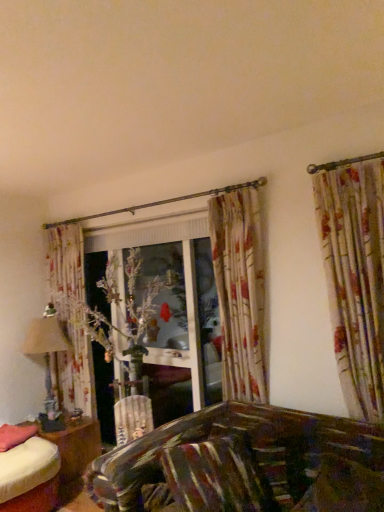
Image resolution: width=384 pixels, height=512 pixels. What do you see at coordinates (75, 446) in the screenshot? I see `wooden table at lower left` at bounding box center [75, 446].

Where is `pink fabric pillow at lower left, which is counted as the 1th pillow, starting from the left`? Image resolution: width=384 pixels, height=512 pixels. pink fabric pillow at lower left, which is counted as the 1th pillow, starting from the left is located at coordinates (15, 435).

Measure the distance between point (184, 489) and camera.

Point (184, 489) is 1.92 meters away from camera.

What do you see at coordinates (47, 352) in the screenshot? I see `matte beige lampshade at left` at bounding box center [47, 352].

Where is `wooden table at lower left`? Image resolution: width=384 pixels, height=512 pixels. wooden table at lower left is located at coordinates (75, 446).

Does pink fabric pillow at lower left, which is the first pillow in back-to-front order, have a lesser width compared to matte beige lampshade at left?

No.

Are pink fabric pillow at lower left, which is counted as the 1th pillow, starting from the left, and matte beige lampshade at left beside each other?

pink fabric pillow at lower left, which is counted as the 1th pillow, starting from the left, is not next to matte beige lampshade at left, and they're not touching.

Between pink fabric pillow at lower left, which is counted as the 1th pillow, starting from the left, and matte beige lampshade at left, which one appears on the right side from the viewer's perspective?

matte beige lampshade at left is more to the right.

From the image's perspective, which is above, pink fabric pillow at lower left, which is the first pillow in back-to-front order, or matte beige lampshade at left?

matte beige lampshade at left is shown above in the image.

Is striped fabric pillow at lower center, the first pillow when ordered from right to left, to the left or to the right of pink fabric pillow at lower left, which is the first pillow in back-to-front order, in the image?

From the image, it's evident that striped fabric pillow at lower center, the first pillow when ordered from right to left, is to the right of pink fabric pillow at lower left, which is the first pillow in back-to-front order.

From the image's perspective, is striped fabric pillow at lower center, the 2th pillow from the left, beneath pink fabric pillow at lower left, which is the first pillow in back-to-front order?

No, from the image's perspective, striped fabric pillow at lower center, the 2th pillow from the left, is not below pink fabric pillow at lower left, which is the first pillow in back-to-front order.

Are striped fabric pillow at lower center, the first pillow when ordered from right to left, and pink fabric pillow at lower left, which is the first pillow in back-to-front order, making contact?

striped fabric pillow at lower center, the first pillow when ordered from right to left, is not next to pink fabric pillow at lower left, which is the first pillow in back-to-front order, and they're not touching.

Which object is wider, striped fabric pillow at lower center, marked as the 1th pillow in a front-to-back arrangement, or pink fabric pillow at lower left, which is the 2th pillow in front-to-back order?

pink fabric pillow at lower left, which is the 2th pillow in front-to-back order, is wider.

From the picture: Does pink fabric pillow at lower left, which is the first pillow in back-to-front order, appear on the right side of striped fabric pillow at lower center, the first pillow when ordered from right to left?

No, pink fabric pillow at lower left, which is the first pillow in back-to-front order, is not to the right of striped fabric pillow at lower center, the first pillow when ordered from right to left.

Is pink fabric pillow at lower left, which is the first pillow in back-to-front order, taller than striped fabric pillow at lower center, marked as the second pillow in a back-to-front arrangement?

No.

Is pink fabric pillow at lower left, positioned as the second pillow in right-to-left order, behind striped fabric pillow at lower center, marked as the second pillow in a back-to-front arrangement?

Yes.

Considering the relative positions of matte beige lampshade at left and striped fabric pillow at lower center, marked as the 1th pillow in a front-to-back arrangement, in the image provided, is matte beige lampshade at left in front of striped fabric pillow at lower center, marked as the 1th pillow in a front-to-back arrangement,?

No, matte beige lampshade at left is further to the viewer.

Is matte beige lampshade at left taller or shorter than striped fabric pillow at lower center, the first pillow when ordered from right to left?

Considering their sizes, matte beige lampshade at left has more height than striped fabric pillow at lower center, the first pillow when ordered from right to left.

From a real-world perspective, who is located lower, matte beige lampshade at left or striped fabric pillow at lower center, the first pillow when ordered from right to left?

In real-world perspective, striped fabric pillow at lower center, the first pillow when ordered from right to left, is lower.

Does wooden table at lower left have a greater height compared to matte beige lampshade at left?

No.

Would you say wooden table at lower left is inside or outside matte beige lampshade at left?

wooden table at lower left is not enclosed by matte beige lampshade at left.

Is wooden table at lower left with matte beige lampshade at left?

They are not placed beside each other.

Is wooden table at lower left to the left or to the right of matte beige lampshade at left in the image?

Based on their positions, wooden table at lower left is located to the right of matte beige lampshade at left.

From the image's perspective, is matte beige lampshade at left positioned above or below wooden table at lower left?

Clearly, from the image's perspective, matte beige lampshade at left is above wooden table at lower left.

Between matte beige lampshade at left and wooden table at lower left, which one has smaller size?

Smaller between the two is wooden table at lower left.

Which is behind, point (53, 410) or point (66, 469)?

The point (53, 410) is farther.

Between matte beige lampshade at left and wooden table at lower left, which one appears on the left side from the viewer's perspective?

From the viewer's perspective, matte beige lampshade at left appears more on the left side.

Is the depth of wooden table at lower left less than that of pink fabric pillow at lower left, positioned as the second pillow in right-to-left order?

No, it is not.

From a real-world perspective, starting from the wooden table at lower left, which pillow is the 1st one vertically above it? Please provide its 2D coordinates.

[(15, 435)]

Would you say wooden table at lower left is inside or outside pink fabric pillow at lower left, positioned as the second pillow in right-to-left order?

wooden table at lower left is not enclosed by pink fabric pillow at lower left, positioned as the second pillow in right-to-left order.

Based on the photo, from the image's perspective, between wooden table at lower left and pink fabric pillow at lower left, which is counted as the 1th pillow, starting from the left, which one is located above?

From the image's view, pink fabric pillow at lower left, which is counted as the 1th pillow, starting from the left, is above.

Identify the location of pillow that is the 2nd one when counting downward from the matte beige lampshade at left (from the image's perspective). (15, 435).

There is a pink fabric pillow at lower left, which is the first pillow in back-to-front order. Where is `pillow above it (from a real-world perspective)`? This screenshot has width=384, height=512. pillow above it (from a real-world perspective) is located at coordinates (217, 476).

Which object lies further to the anchor point matte beige lampshade at left, striped fabric pillow at lower center, marked as the 1th pillow in a front-to-back arrangement, or pink fabric pillow at lower left, which is counted as the 1th pillow, starting from the left?

Among the two, striped fabric pillow at lower center, marked as the 1th pillow in a front-to-back arrangement, is located further to matte beige lampshade at left.

When comparing their distances from pink fabric pillow at lower left, which is the first pillow in back-to-front order, does wooden table at lower left or striped fabric pillow at lower center, the first pillow when ordered from right to left, seem closer?

wooden table at lower left is closer to pink fabric pillow at lower left, which is the first pillow in back-to-front order.

Which object lies nearer to the anchor point striped fabric pillow at lower center, marked as the second pillow in a back-to-front arrangement, pink fabric pillow at lower left, which is the 2th pillow in front-to-back order, or matte beige lampshade at left?

pink fabric pillow at lower left, which is the 2th pillow in front-to-back order.

Considering their positions, is pink fabric pillow at lower left, which is the 2th pillow in front-to-back order, positioned further to wooden table at lower left than striped fabric pillow at lower center, marked as the 1th pillow in a front-to-back arrangement?

Among the two, striped fabric pillow at lower center, marked as the 1th pillow in a front-to-back arrangement, is located further to wooden table at lower left.

Considering their positions, is pink fabric pillow at lower left, positioned as the second pillow in right-to-left order, positioned further to matte beige lampshade at left than striped fabric pillow at lower center, the 2th pillow from the left?

striped fabric pillow at lower center, the 2th pillow from the left.

Looking at the image, which one is located closer to striped fabric pillow at lower center, the first pillow when ordered from right to left, wooden table at lower left or matte beige lampshade at left?

The object closer to striped fabric pillow at lower center, the first pillow when ordered from right to left, is wooden table at lower left.

Considering their positions, is wooden table at lower left positioned closer to matte beige lampshade at left than pink fabric pillow at lower left, which is counted as the 1th pillow, starting from the left?

wooden table at lower left.

Looking at the image, which one is located closer to wooden table at lower left, matte beige lampshade at left or striped fabric pillow at lower center, marked as the 1th pillow in a front-to-back arrangement?

matte beige lampshade at left lies closer to wooden table at lower left than the other object.

You are a GUI agent. You are given a task and a screenshot of the screen. Output one action in this format:
    pyautogui.click(x=<x>, y=<y>)
    Task: Click on the pillow positioned between striped fabric pillow at lower center, marked as the second pillow in a back-to-front arrangement, and matte beige lampshade at left from near to far
    This screenshot has width=384, height=512.
    Given the screenshot: What is the action you would take?
    pyautogui.click(x=15, y=435)

Locate an element on the screen. table between striped fabric pillow at lower center, the first pillow when ordered from right to left, and matte beige lampshade at left in the front-back direction is located at coordinates (75, 446).

Locate an element on the screen. The width and height of the screenshot is (384, 512). table between pink fabric pillow at lower left, which is the 2th pillow in front-to-back order, and striped fabric pillow at lower center, marked as the second pillow in a back-to-front arrangement, from left to right is located at coordinates (75, 446).